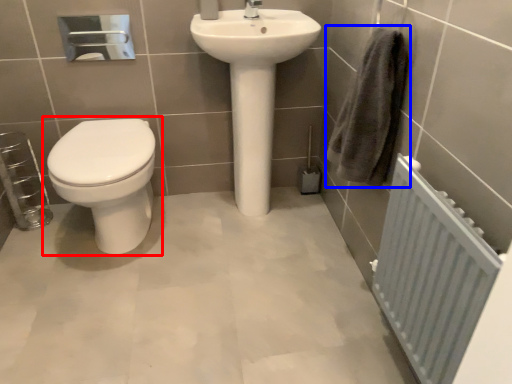
Question: Which object is further to the camera taking this photo, toilet (highlighted by a red box) or bath towel (highlighted by a blue box)?

Choices:
 (A) toilet
 (B) bath towel

Answer: (A)